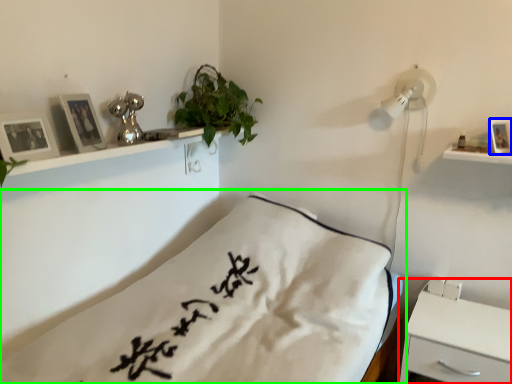
Question: Which object is the closest to the nightstand (highlighted by a red box)? Choose among these: picture frame (highlighted by a blue box) or bed (highlighted by a green box).

Choices:
 (A) picture frame
 (B) bed

Answer: (B)